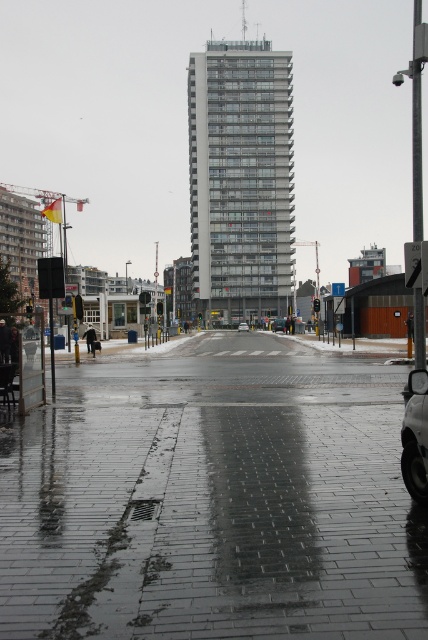
Question: Does shiny silver car at lower right appear on the right side of silver metallic sedan at center?

Choices:
 (A) no
 (B) yes

Answer: (A)

Question: Which of these objects is positioned closest to the wet brick pavement at center?

Choices:
 (A) shiny silver car at lower right
 (B) silver metallic sedan at center
 (C) gray concrete building at center

Answer: (A)

Question: Among these points, which one is nearest to the camera?

Choices:
 (A) (238, 328)
 (B) (401, 580)

Answer: (B)

Question: Based on their relative distances, which object is farther from the shiny silver car at lower right?

Choices:
 (A) wet brick pavement at center
 (B) gray concrete building at center

Answer: (B)

Question: Is shiny silver car at lower right to the right of silver metallic sedan at center from the viewer's perspective?

Choices:
 (A) no
 (B) yes

Answer: (A)

Question: Is the position of wet brick pavement at center less distant than that of silver metallic sedan at center?

Choices:
 (A) no
 (B) yes

Answer: (B)